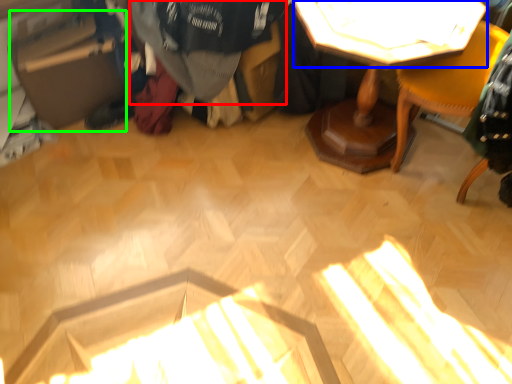
Question: Estimate the real-world distances between objects in this image. Which object is farther from clothing (highlighted by a red box), table top (highlighted by a blue box) or cardboard box (highlighted by a green box)?

Choices:
 (A) table top
 (B) cardboard box

Answer: (B)